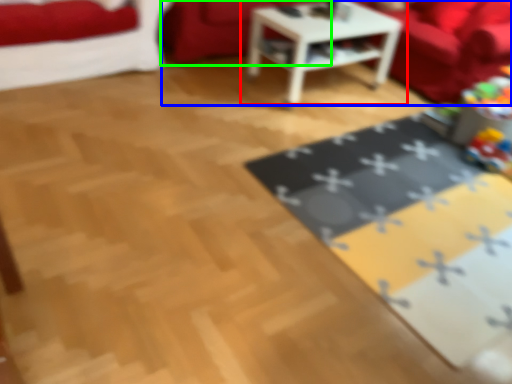
Question: Which object is the closest to the table (highlighted by a red box)? Choose among these: couch (highlighted by a blue box) or couch (highlighted by a green box).

Choices:
 (A) couch
 (B) couch

Answer: (B)